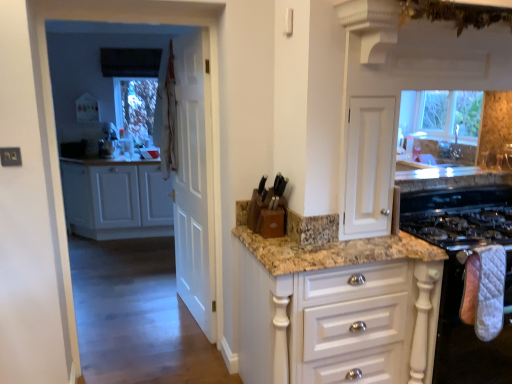
Where is `space that is in front of wooden knife block at center, the 2th appliance in the bottom-to-top sequence`? space that is in front of wooden knife block at center, the 2th appliance in the bottom-to-top sequence is located at coordinates (275, 242).